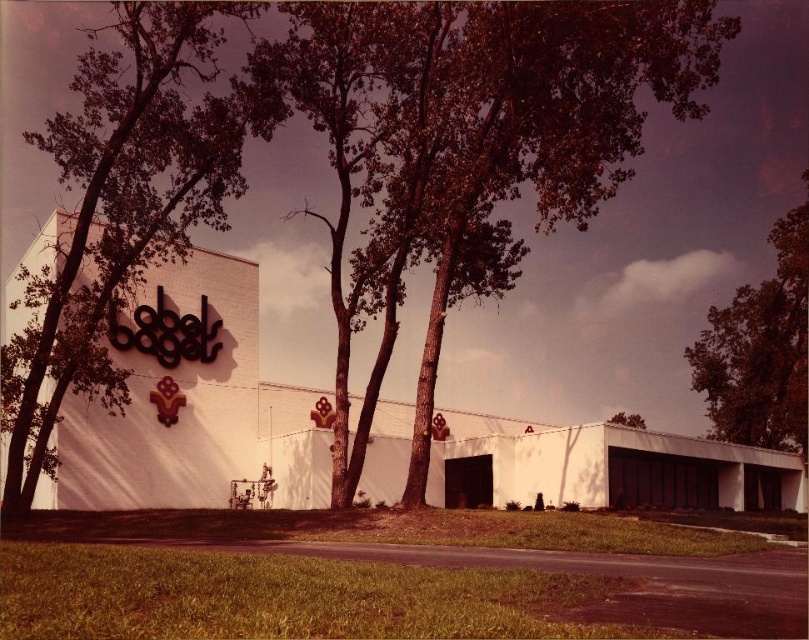
Is green leafy tree at upper left shorter than green leafy tree at upper right?

Incorrect, green leafy tree at upper left's height does not fall short of green leafy tree at upper right's.

Who is higher up, green leafy tree at upper left or green leafy tree at upper right?

green leafy tree at upper left

I want to click on green leafy tree at upper left, so click(121, 204).

Can you confirm if green leafy tree at upper right is bigger than green leafy tree at upper center?

Correct, green leafy tree at upper right is larger in size than green leafy tree at upper center.

Can you confirm if green leafy tree at upper right is positioned below green leafy tree at upper center?

Incorrect, green leafy tree at upper right is not positioned below green leafy tree at upper center.

Locate an element on the screen. This screenshot has height=640, width=809. green leafy tree at upper right is located at coordinates (760, 349).

Who is more distant from viewer, (244,8) or (637,417)?

The point (637,417) is behind.

Is green leafy tree at upper left behind green leafy tree at upper center?

No, green leafy tree at upper left is closer to the viewer.

Image resolution: width=809 pixels, height=640 pixels. I want to click on green leafy tree at upper left, so click(121, 204).